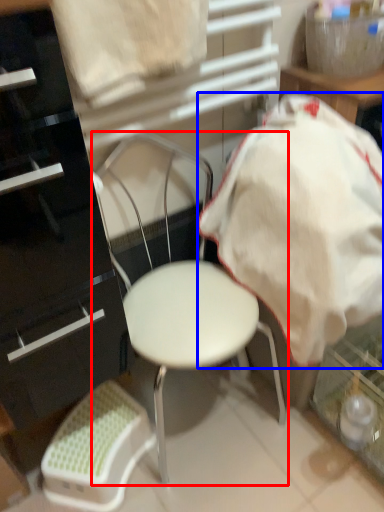
Question: Which object appears farthest to the camera in this image, chair (highlighted by a red box) or blanket (highlighted by a blue box)?

Choices:
 (A) chair
 (B) blanket

Answer: (B)